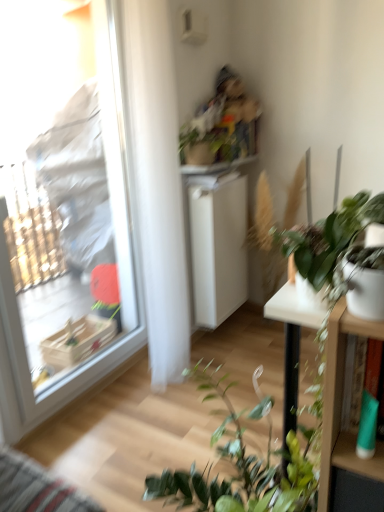
Question: Considering the relative positions of transparent plastic window at left and white glossy table at right in the image provided, is transparent plastic window at left to the right of white glossy table at right from the viewer's perspective?

Choices:
 (A) no
 (B) yes

Answer: (A)

Question: Does transparent plastic window at left have a greater width compared to white glossy table at right?

Choices:
 (A) yes
 (B) no

Answer: (A)

Question: From the image's perspective, is transparent plastic window at left above white glossy table at right?

Choices:
 (A) yes
 (B) no

Answer: (A)

Question: Is white glossy table at right at the back of transparent plastic window at left?

Choices:
 (A) no
 (B) yes

Answer: (A)

Question: From the image's perspective, is transparent plastic window at left below white glossy table at right?

Choices:
 (A) no
 (B) yes

Answer: (A)

Question: Is the position of transparent plastic window at left more distant than that of white glossy table at right?

Choices:
 (A) no
 (B) yes

Answer: (B)

Question: Does transparent plastic window at left come behind white matte cabinet at center?

Choices:
 (A) yes
 (B) no

Answer: (B)

Question: Can you confirm if transparent plastic window at left is taller than white matte cabinet at center?

Choices:
 (A) yes
 (B) no

Answer: (A)

Question: Is transparent plastic window at left closer to camera compared to white matte cabinet at center?

Choices:
 (A) no
 (B) yes

Answer: (B)

Question: From the image's perspective, is transparent plastic window at left on top of white matte cabinet at center?

Choices:
 (A) no
 (B) yes

Answer: (B)

Question: Is transparent plastic window at left touching white matte cabinet at center?

Choices:
 (A) no
 (B) yes

Answer: (A)

Question: From the image's perspective, does transparent plastic window at left appear lower than white matte cabinet at center?

Choices:
 (A) yes
 (B) no

Answer: (B)

Question: Is green matte plant at right, the 1th houseplant positioned from the front, smaller than green matte plant at upper center, acting as the 1th houseplant starting from the top?

Choices:
 (A) yes
 (B) no

Answer: (A)